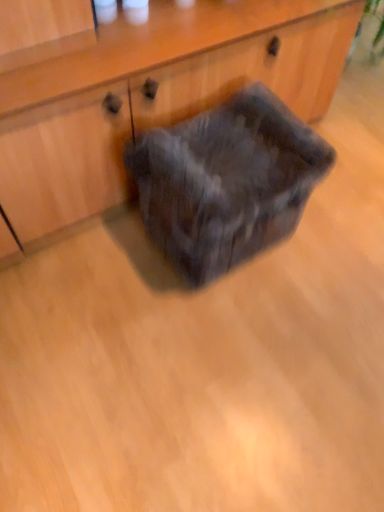
The image size is (384, 512). What do you see at coordinates (226, 181) in the screenshot? I see `textured gray fabric chair at center` at bounding box center [226, 181].

Looking at this image, what is the approximate width of textured gray fabric chair at center?

textured gray fabric chair at center is 13.13 inches in width.

Where is `textured gray fabric chair at center`? The image size is (384, 512). textured gray fabric chair at center is located at coordinates (226, 181).

I want to click on textured gray fabric chair at center, so click(226, 181).